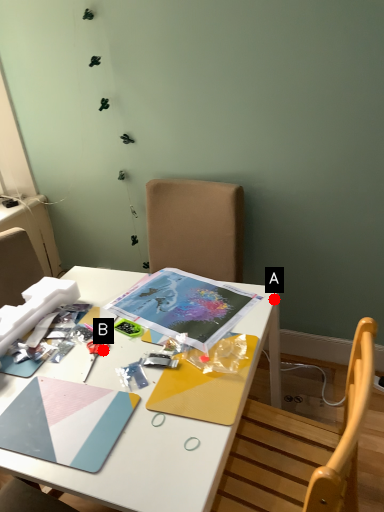
Question: Two points are circled on the image, labeled by A and B beside each circle. Which point is closer to the camera?

Choices:
 (A) A is closer
 (B) B is closer

Answer: (B)